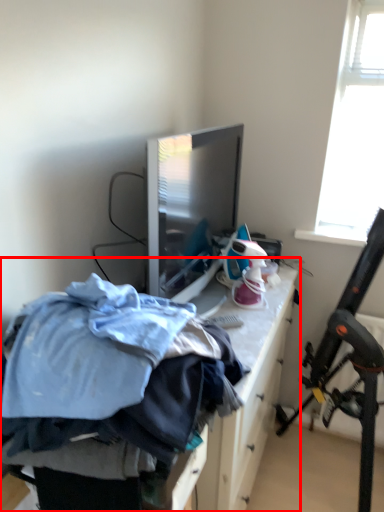
Question: In this image, where is furniture (annotated by the red box) located relative to folding chair?

Choices:
 (A) left
 (B) right

Answer: (A)